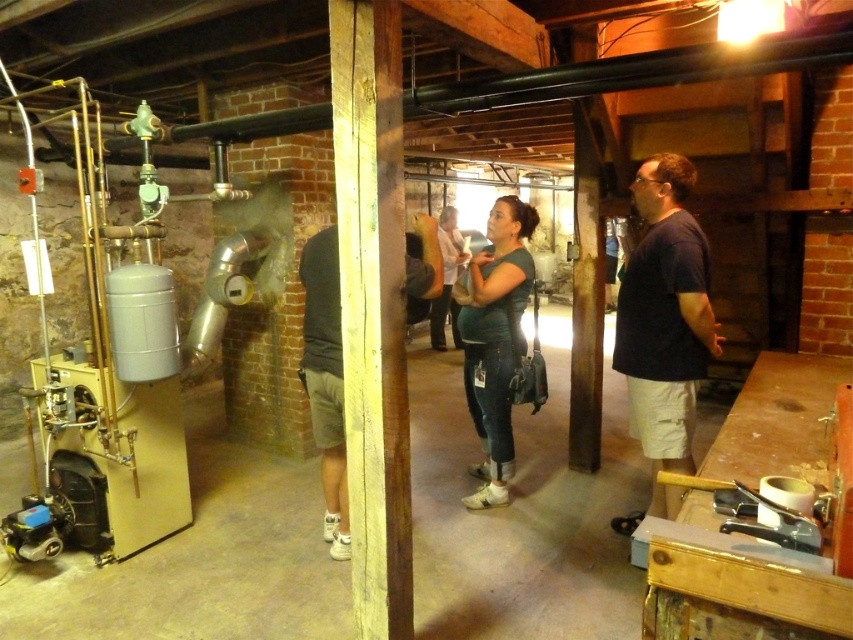
You are standing in the room and see two people wearing dark green jersey at center and dark gray fabric shorts at center. Which clothing item is positioned more to the right side of the scene?

The dark green jersey at center is positioned to the right of the dark gray fabric shorts at center, so the dark green jersey at center is more to the right side of the scene.